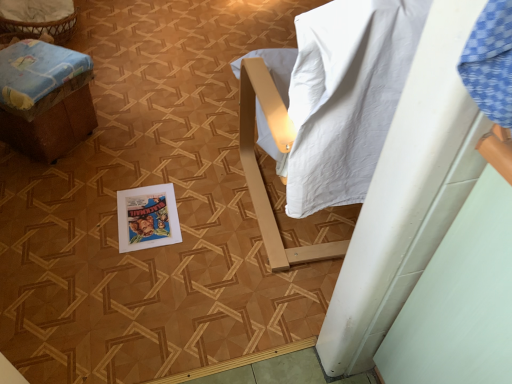
What is the approximate width of brown cardboard box at left?

17.32 inches.

Locate an element on the screen. Image resolution: width=512 pixels, height=384 pixels. brown cardboard box at left is located at coordinates (45, 99).

What do you see at coordinates (45, 99) in the screenshot?
I see `brown cardboard box at left` at bounding box center [45, 99].

The width and height of the screenshot is (512, 384). What do you see at coordinates (147, 218) in the screenshot?
I see `vivid poster at center` at bounding box center [147, 218].

Where is `vivid poster at center`? vivid poster at center is located at coordinates (147, 218).

The image size is (512, 384). I want to click on brown cardboard box at left, so click(x=45, y=99).

Can you confirm if vivid poster at center is positioned to the right of brown cardboard box at left?

Indeed, vivid poster at center is positioned on the right side of brown cardboard box at left.

Considering their positions, is vivid poster at center located in front of or behind brown cardboard box at left?

vivid poster at center is behind brown cardboard box at left.

Does point (155, 228) come behind point (30, 117)?

No.

From the image's perspective, between vivid poster at center and brown cardboard box at left, who is located below?

vivid poster at center.

From a real-world perspective, is vivid poster at center located higher than brown cardboard box at left?

No, from a real-world perspective, vivid poster at center is not above brown cardboard box at left.

Can you confirm if vivid poster at center is wider than brown cardboard box at left?

No, vivid poster at center is not wider than brown cardboard box at left.

Considering the sizes of vivid poster at center and brown cardboard box at left in the image, is vivid poster at center taller or shorter than brown cardboard box at left?

vivid poster at center is shorter than brown cardboard box at left.

Considering the sizes of objects vivid poster at center and brown cardboard box at left in the image provided, who is bigger, vivid poster at center or brown cardboard box at left?

Bigger between the two is brown cardboard box at left.

Is brown cardboard box at left completely or partially inside vivid poster at center?

Definitely not — brown cardboard box at left is not inside vivid poster at center.

Are vivid poster at center and brown cardboard box at left far apart?

They are positioned close to each other.

Is vivid poster at center aimed at brown cardboard box at left?

No, vivid poster at center is not oriented towards brown cardboard box at left.

Locate an element on the screen. The height and width of the screenshot is (384, 512). comic book on the right of brown cardboard box at left is located at coordinates (147, 218).

Does brown cardboard box at left appear on the left side of vivid poster at center?

Yes, brown cardboard box at left is to the left of vivid poster at center.

Does brown cardboard box at left come in front of vivid poster at center?

Yes, brown cardboard box at left is closer to the viewer.

Which is farther, [33,80] or [160,202]?

The point [160,202] is farther.

From the image's perspective, between brown cardboard box at left and vivid poster at center, which one is located above?

brown cardboard box at left is shown above in the image.

From a real-world perspective, is brown cardboard box at left located beneath vivid poster at center?

Incorrect, from a real-world perspective, brown cardboard box at left is higher than vivid poster at center.

Which of these two, brown cardboard box at left or vivid poster at center, is thinner?

Thinner between the two is vivid poster at center.

Is brown cardboard box at left taller than vivid poster at center?

Correct, brown cardboard box at left is much taller as vivid poster at center.

Can you confirm if brown cardboard box at left is smaller than vivid poster at center?

No.

Is vivid poster at center inside brown cardboard box at left?

No, vivid poster at center is not a part of brown cardboard box at left.

Are brown cardboard box at left and vivid poster at center making contact?

brown cardboard box at left and vivid poster at center are clearly separated.

Is brown cardboard box at left oriented away from vivid poster at center?

No.

Looking at this image, what's the angular difference between brown cardboard box at left and vivid poster at center's facing directions?

The angle between the facing direction of brown cardboard box at left and the facing direction of vivid poster at center is 87.4 degrees.

This screenshot has width=512, height=384. Find the location of `furniture lying on the left of vivid poster at center`. furniture lying on the left of vivid poster at center is located at coordinates (45, 99).

Locate an element on the screen. comic book that is under the brown cardboard box at left (from a real-world perspective) is located at coordinates (147, 218).

I want to click on furniture that is in front of the vivid poster at center, so click(x=45, y=99).